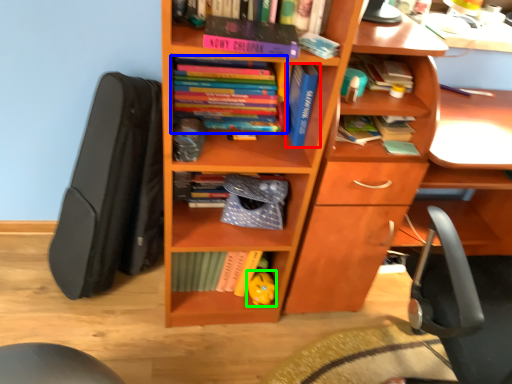
Question: Based on their relative distances, which object is farther from book (highlighted by a red box)? Choose from book (highlighted by a blue box) and toy (highlighted by a green box).

Choices:
 (A) book
 (B) toy

Answer: (B)